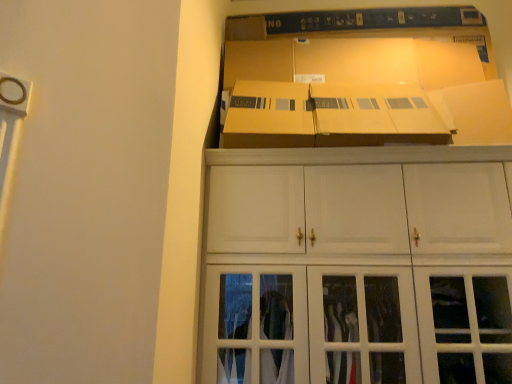
The width and height of the screenshot is (512, 384). What do you see at coordinates (362, 79) in the screenshot? I see `brown cardboard box at upper center` at bounding box center [362, 79].

At what (x,y) coordinates should I click in order to perform the action: click on brown cardboard box at upper center. Please return your answer as a coordinate pair (x, y). This screenshot has height=384, width=512. Looking at the image, I should click on (362, 79).

What is the approximate width of brown cardboard box at upper center?

The width of brown cardboard box at upper center is 19.79 inches.

The width and height of the screenshot is (512, 384). I want to click on brown cardboard box at upper center, so click(x=362, y=79).